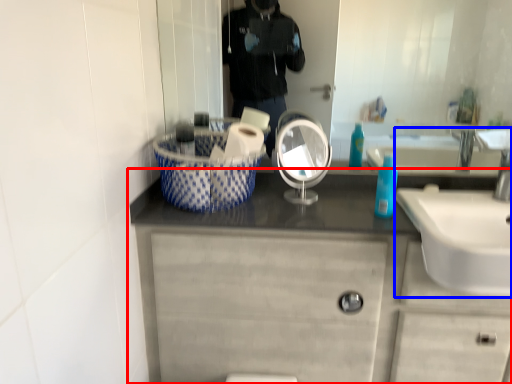
Question: Which of the following is the farthest to the observer, bathroom cabinet (highlighted by a red box) or sink (highlighted by a blue box)?

Choices:
 (A) bathroom cabinet
 (B) sink

Answer: (A)